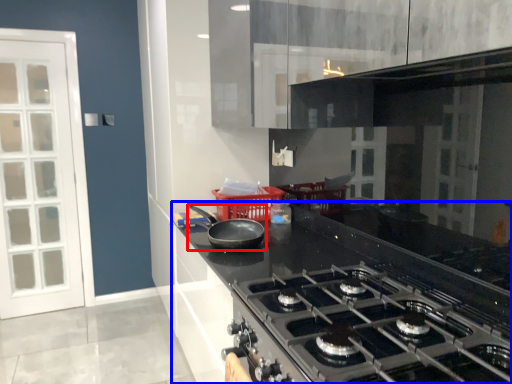
Question: Which of the following is the closest to the observer, kitchen appliance (highlighted by a red box) or countertop (highlighted by a blue box)?

Choices:
 (A) kitchen appliance
 (B) countertop

Answer: (B)